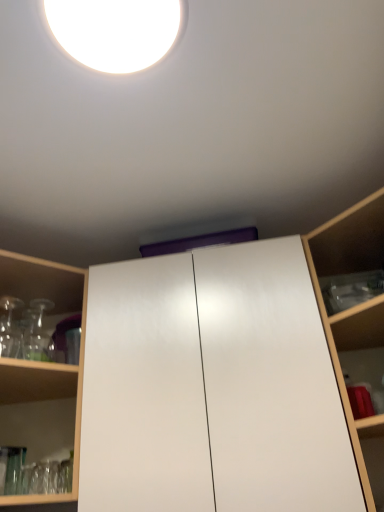
Question: Is white glossy droplight at upper center facing away from transparent glassware at left, arranged as the first shelf when viewed from the left?

Choices:
 (A) yes
 (B) no

Answer: (B)

Question: Does white glossy droplight at upper center contain transparent glassware at left, arranged as the first shelf when viewed from the left?

Choices:
 (A) no
 (B) yes

Answer: (A)

Question: From a real-world perspective, is white glossy droplight at upper center located beneath transparent glassware at left, the second shelf from the right?

Choices:
 (A) no
 (B) yes

Answer: (A)

Question: Is white glossy droplight at upper center positioned in front of transparent glassware at left, arranged as the first shelf when viewed from the left?

Choices:
 (A) yes
 (B) no

Answer: (A)

Question: Does white glossy droplight at upper center turn towards transparent glassware at left, the second shelf from the right?

Choices:
 (A) yes
 (B) no

Answer: (B)

Question: Visually, is white glossy droplight at upper center positioned to the left or to the right of white glossy cabinet at center?

Choices:
 (A) left
 (B) right

Answer: (A)

Question: From the image's perspective, is white glossy droplight at upper center positioned above or below white glossy cabinet at center?

Choices:
 (A) below
 (B) above

Answer: (B)

Question: From a real-world perspective, is white glossy droplight at upper center above or below white glossy cabinet at center?

Choices:
 (A) above
 (B) below

Answer: (A)

Question: Choose the correct answer: Is white glossy droplight at upper center inside white glossy cabinet at center or outside it?

Choices:
 (A) inside
 (B) outside

Answer: (B)

Question: Is transparent glassware at left, the second shelf from the right, wider or thinner than white glossy cabinet at center?

Choices:
 (A) thin
 (B) wide

Answer: (B)

Question: From the image's perspective, relative to white glossy cabinet at center, is transparent glassware at left, the second shelf from the right, above or below?

Choices:
 (A) below
 (B) above

Answer: (A)

Question: Does point (72, 389) appear closer or farther from the camera than point (309, 271)?

Choices:
 (A) closer
 (B) farther

Answer: (B)

Question: Considering their positions, is transparent glassware at left, arranged as the first shelf when viewed from the left, located in front of or behind white glossy cabinet at center?

Choices:
 (A) behind
 (B) front

Answer: (B)

Question: Which is correct: wooden shelf at right, the 1th shelf from the right, is inside transparent glassware at left, arranged as the first shelf when viewed from the left, or outside of it?

Choices:
 (A) outside
 (B) inside

Answer: (A)

Question: From the image's perspective, relative to transparent glassware at left, arranged as the first shelf when viewed from the left, is wooden shelf at right, the 1th shelf from the right, above or below?

Choices:
 (A) below
 (B) above

Answer: (B)